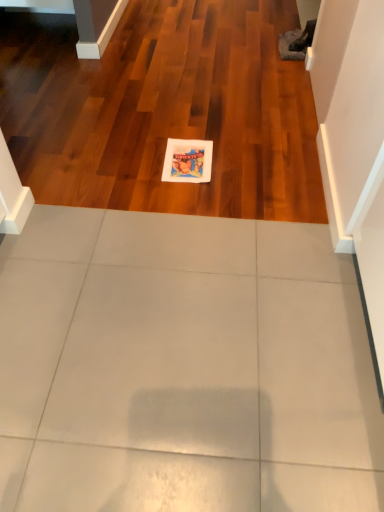
Where is `empty space that is ontop of matte paper postcard at center (from a real-world perspective)`? empty space that is ontop of matte paper postcard at center (from a real-world perspective) is located at coordinates (187, 156).